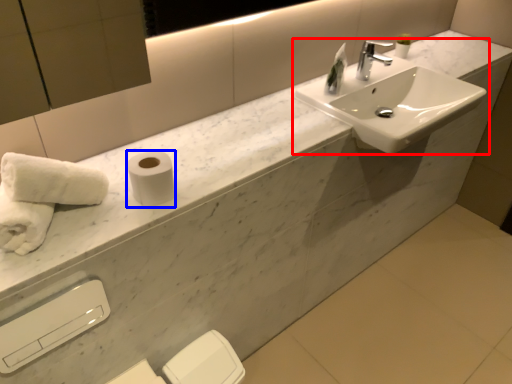
Question: Which object is closer to the camera taking this photo, sink (highlighted by a red box) or toilet paper (highlighted by a blue box)?

Choices:
 (A) sink
 (B) toilet paper

Answer: (B)